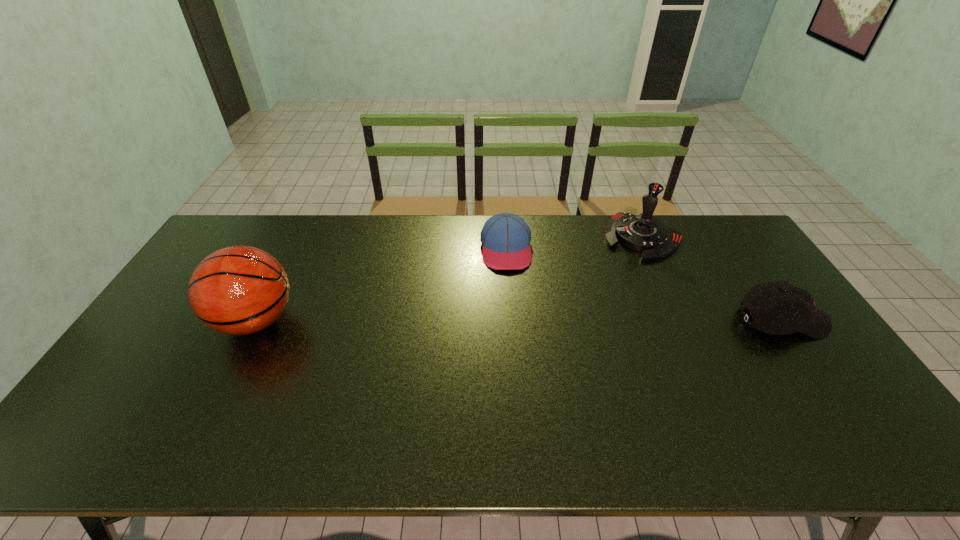
This screenshot has height=540, width=960. Find the location of `vacant space at the far edge of the desktop`. vacant space at the far edge of the desktop is located at coordinates (570, 240).

The image size is (960, 540). Identify the location of vacant area at the near edge. coord(212,408).

Locate an element on the screen. vacant space at the right edge is located at coordinates (739, 297).

In the image, there is a desktop. Identify the location of vacant space at the near left corner. (97, 401).

Identify the location of vacant region at the far right corner of the desktop. (708, 233).

Find the location of a particular element. The width and height of the screenshot is (960, 540). vacant point located between the left baseball cap and the right baseball cap is located at coordinates (644, 285).

This screenshot has width=960, height=540. I want to click on free space between the joystick and the nearer baseball cap, so click(x=712, y=279).

This screenshot has width=960, height=540. I want to click on unoccupied area between the right baseball cap and the tallest object, so click(x=519, y=320).

The image size is (960, 540). In order to click on free space between the joystick and the basketball in this screenshot , I will do `click(449, 279)`.

The image size is (960, 540). Find the location of `free area in between the right baseball cap and the tallest object`. free area in between the right baseball cap and the tallest object is located at coordinates tap(519, 320).